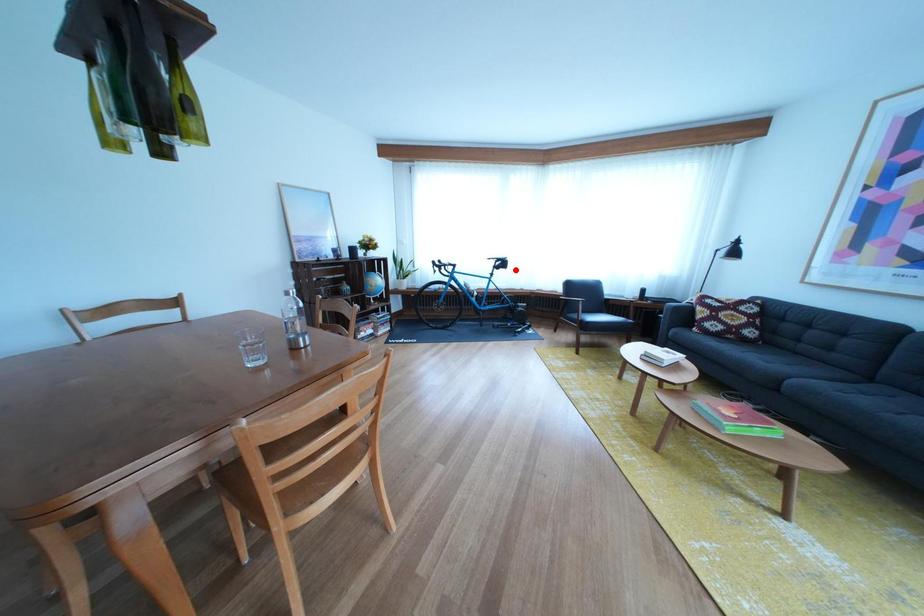
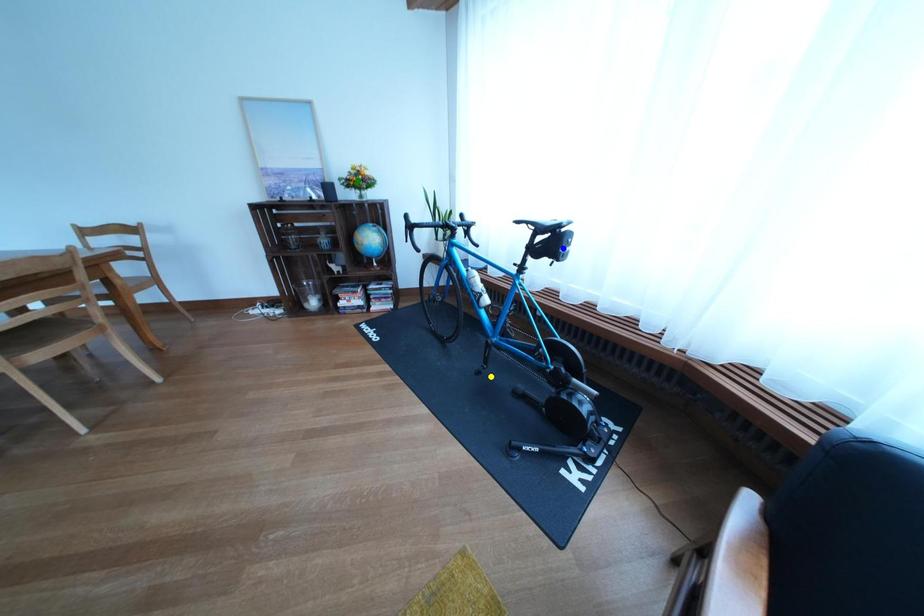
Question: I am providing you with two images of the same scene from different viewpoints. A red point is marked on the first image. You are given multiple points on the second image. Can you choose the point in image 2 that corresponds to the point in image 1?

Choices:
 (A) yellow point
 (B) blue point
 (C) green point

Answer: (B)